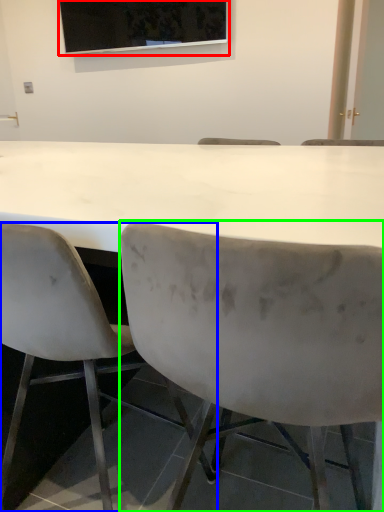
Question: Which object is positioned farthest from projection screen (highlighted by a red box)? Select from chair (highlighted by a blue box) and chair (highlighted by a green box).

Choices:
 (A) chair
 (B) chair

Answer: (B)